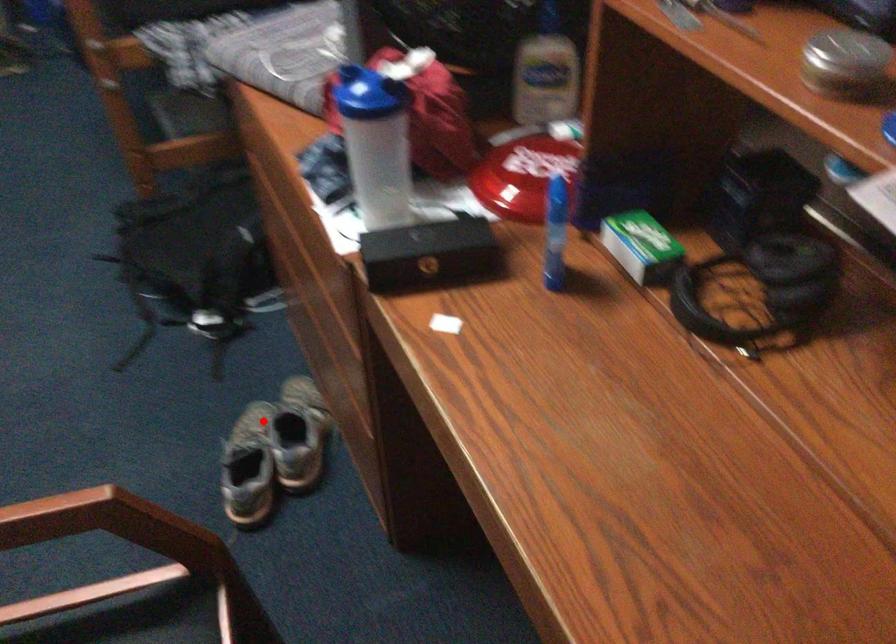
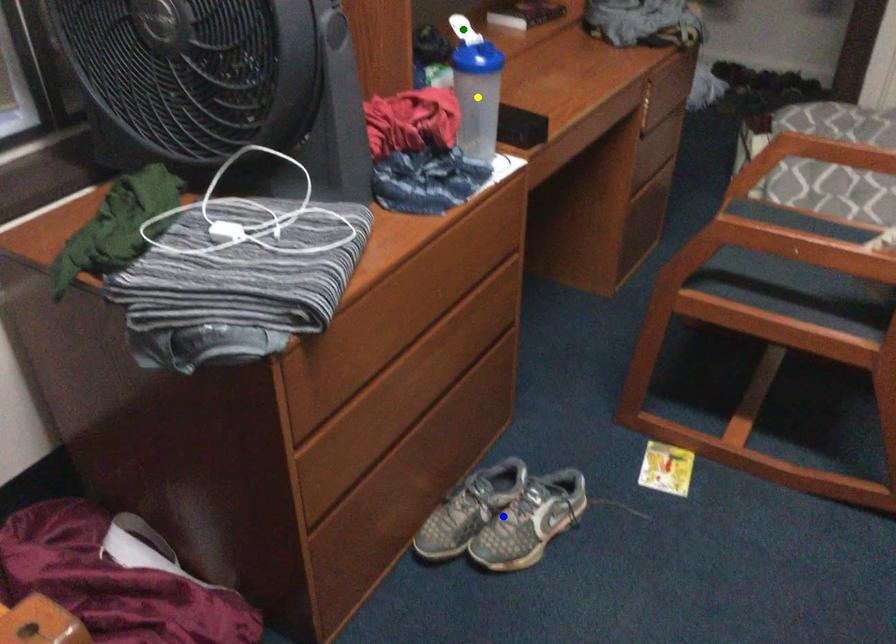
Question: I am providing you with two images of the same scene from different viewpoints. A red point is marked on the first image. You are given multiple points on the second image. Can you choose the point in image 2 that corresponds to the point in image 1?

Choices:
 (A) yellow point
 (B) blue point
 (C) green point

Answer: (B)